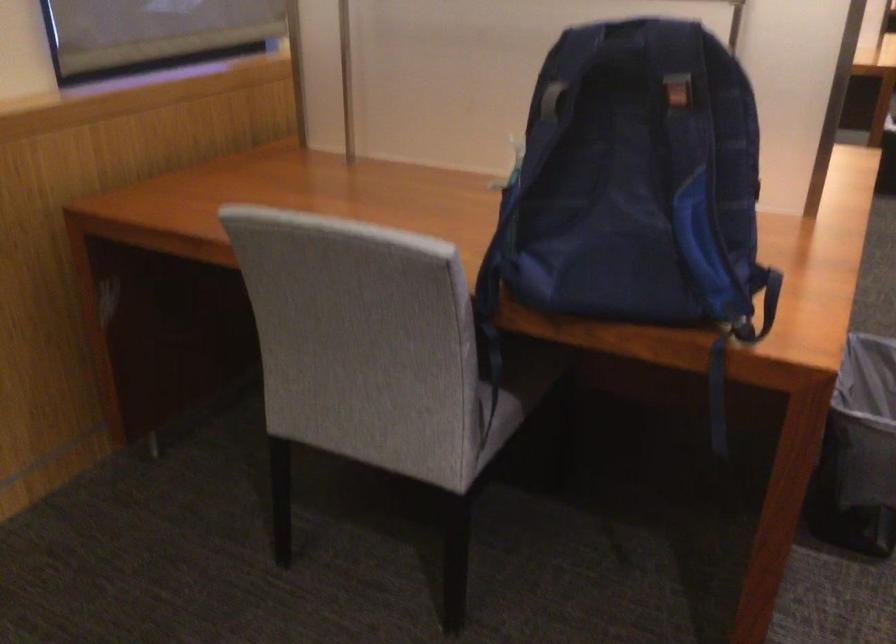
Where would you pull the blue backpack strap? Please return your answer as a coordinate pair (x, y).

(718, 395)